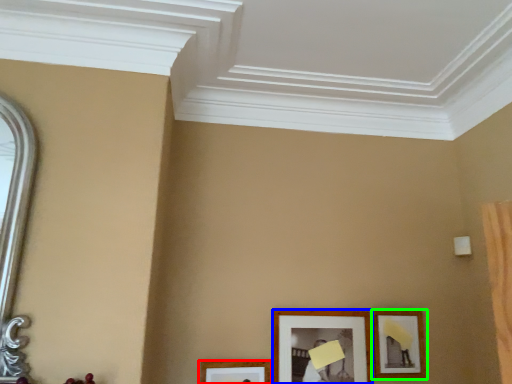
Question: Which is nearer to the picture frame (highlighted by a red box)? picture frame (highlighted by a blue box) or picture frame (highlighted by a green box).

Choices:
 (A) picture frame
 (B) picture frame

Answer: (A)